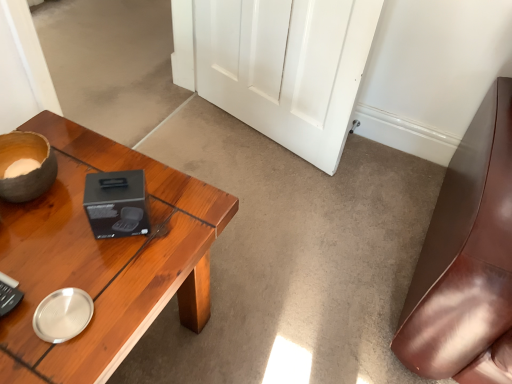
Find the location of a particular element. The image size is (512, 384). vacant position to the left of white glossy door at center is located at coordinates (205, 143).